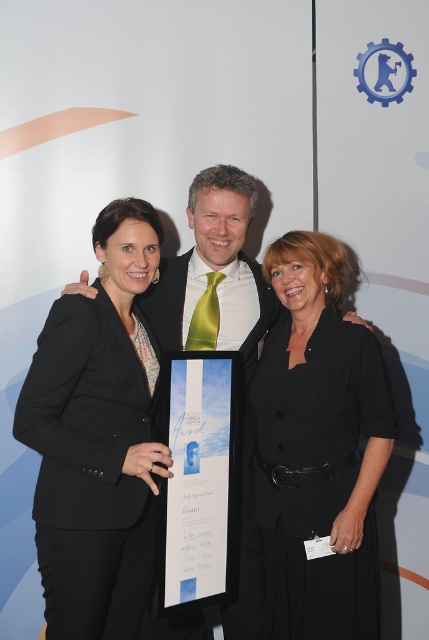
Question: Is black suit at left positioned at the back of green satin tie at center?

Choices:
 (A) yes
 (B) no

Answer: (B)

Question: Does black suit at left have a greater width compared to green satin tie at center?

Choices:
 (A) no
 (B) yes

Answer: (A)

Question: Which point is farther to the camera?

Choices:
 (A) black matte dress at center
 (B) green satin tie at center
 (C) black suit at left

Answer: (B)

Question: Which object appears closest to the camera in this image?

Choices:
 (A) black suit at left
 (B) green satin tie at center

Answer: (A)

Question: Which point is closer to the camera?

Choices:
 (A) black matte dress at center
 (B) black suit at left

Answer: (B)

Question: Does black matte dress at center come behind green satin tie at center?

Choices:
 (A) no
 (B) yes

Answer: (A)